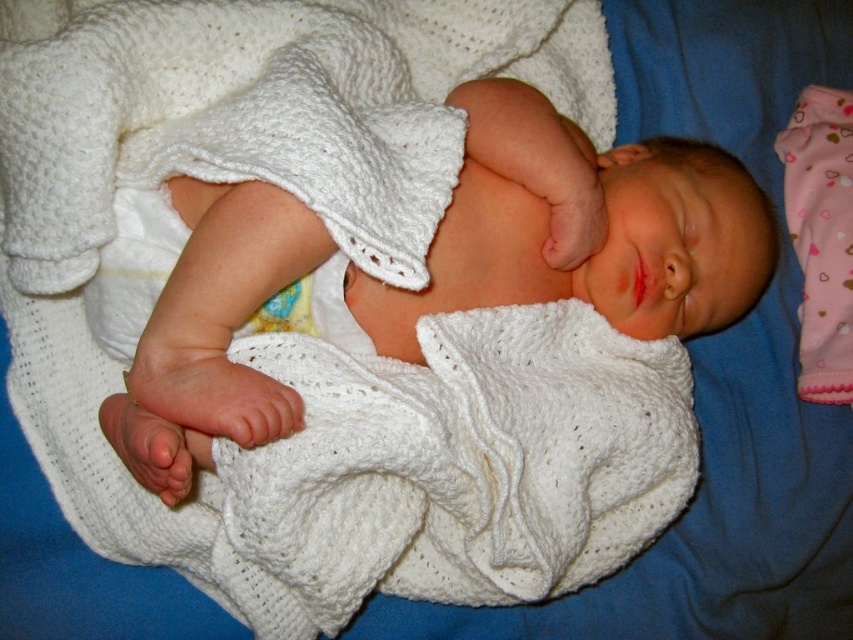
Does white knitted blanket at center appear under smooth plastic teething ring at center?

No.

Looking at this image, does white knitted blanket at center have a larger size compared to smooth plastic teething ring at center?

Yes.

You are a GUI agent. You are given a task and a screenshot of the screen. Output one action in this format:
    pyautogui.click(x=<x>, y=<y>)
    Task: Click on the white knitted blanket at center
    The height and width of the screenshot is (640, 853).
    Given the screenshot: What is the action you would take?
    pyautogui.click(x=425, y=262)

This screenshot has height=640, width=853. What are the coordinates of `white knitted blanket at center` in the screenshot? It's located at (425, 262).